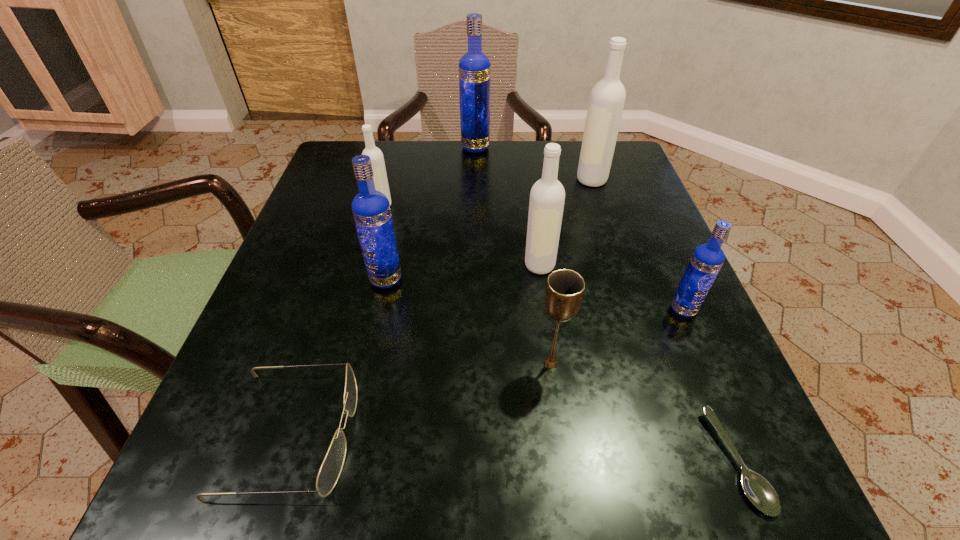
Locate an element on the screen. vacant space located 0.100m on the front of the nearest vodka is located at coordinates (710, 372).

Find the location of a particular element. free space located on the right of the third farthest vodka is located at coordinates (514, 205).

Where is `blank space located on the left of the third nearest object`? The width and height of the screenshot is (960, 540). blank space located on the left of the third nearest object is located at coordinates (288, 363).

This screenshot has width=960, height=540. In order to click on vacant space located 0.330m on the front-facing side of the beige spectacles in this screenshot , I will do `click(603, 434)`.

Where is `vacant space located 0.290m on the left of the shortest object`? This screenshot has width=960, height=540. vacant space located 0.290m on the left of the shortest object is located at coordinates (487, 461).

At what (x,y) coordinates should I click in order to perform the action: click on spectacles located in the near edge section of the desktop. Please return your answer as a coordinate pair (x, y). Looking at the image, I should click on (331, 468).

The image size is (960, 540). In order to click on soupspoon that is at the near edge in this screenshot , I will do `click(759, 491)`.

Locate an element on the screen. This screenshot has width=960, height=540. vodka located at the left edge is located at coordinates (377, 160).

Locate an element on the screen. This screenshot has height=540, width=960. spectacles present at the left edge is located at coordinates (331, 468).

The image size is (960, 540). I want to click on soupspoon that is positioned at the right edge, so click(759, 491).